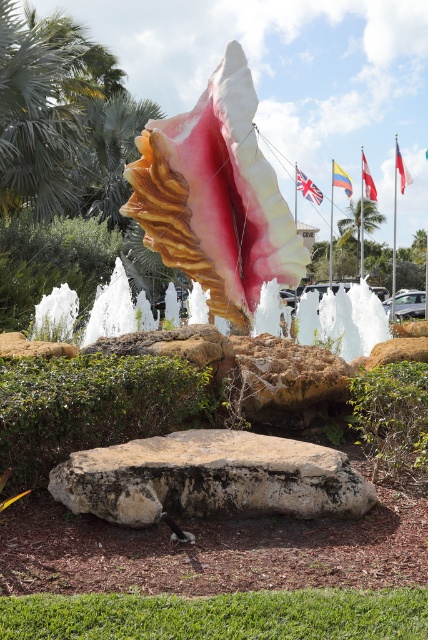
Who is more forward, (338, 465) or (297, 186)?

Point (338, 465) is in front.

Between speckled beige rock at center and british flag at center, which one appears on the right side from the viewer's perspective?

From the viewer's perspective, british flag at center appears more on the right side.

Is point (222, 486) farther from viewer compared to point (311, 195)?

No, (222, 486) is in front of (311, 195).

Find the location of `speckled beige rock at center`. speckled beige rock at center is located at coordinates (211, 477).

Who is more forward, (320, 192) or (366, 188)?

Point (366, 188) is more forward.

Consider the image. Who is higher up, british flag at center or red fabric flag at upper center?

british flag at center

This screenshot has width=428, height=640. I want to click on british flag at center, so (x=308, y=188).

What do you see at coordinates (211, 477) in the screenshot? This screenshot has height=640, width=428. I see `speckled beige rock at center` at bounding box center [211, 477].

Is speckled beige rock at center shorter than red fabric flag at upper right?

Yes, speckled beige rock at center is shorter than red fabric flag at upper right.

The height and width of the screenshot is (640, 428). What are the coordinates of `speckled beige rock at center` in the screenshot? It's located at (211, 477).

Locate an element on the screen. This screenshot has width=428, height=640. speckled beige rock at center is located at coordinates (211, 477).